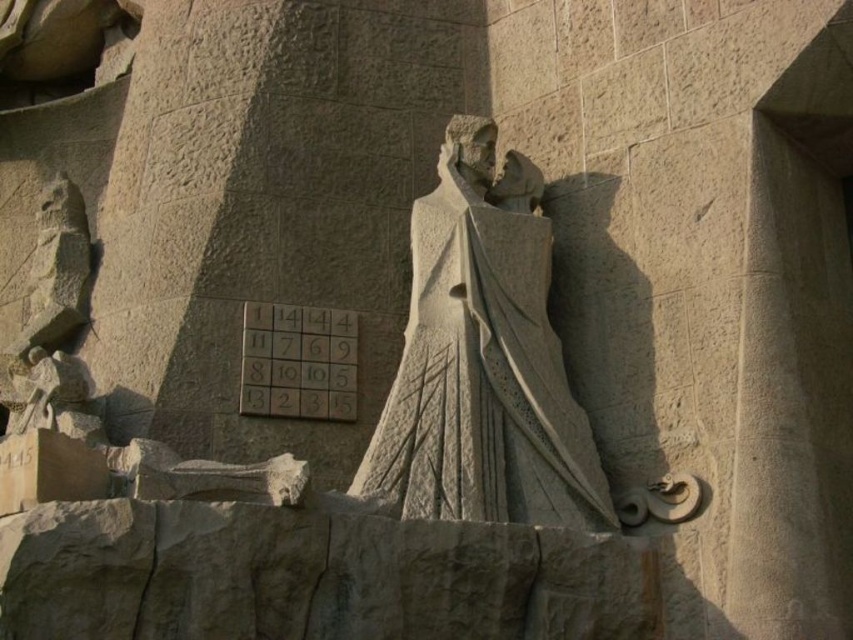
Question: Which point is closer to the camera?

Choices:
 (A) (265, 326)
 (B) (412, 461)

Answer: (B)

Question: Which of the following is the farthest from the observer?

Choices:
 (A) (315, 317)
 (B) (357, 484)

Answer: (A)

Question: Can you confirm if stone statue at center is positioned to the left of matte stone plaque at center?

Choices:
 (A) yes
 (B) no

Answer: (B)

Question: Is stone statue at center in front of matte stone plaque at center?

Choices:
 (A) yes
 (B) no

Answer: (A)

Question: Is stone statue at center to the left of matte stone plaque at center from the viewer's perspective?

Choices:
 (A) no
 (B) yes

Answer: (A)